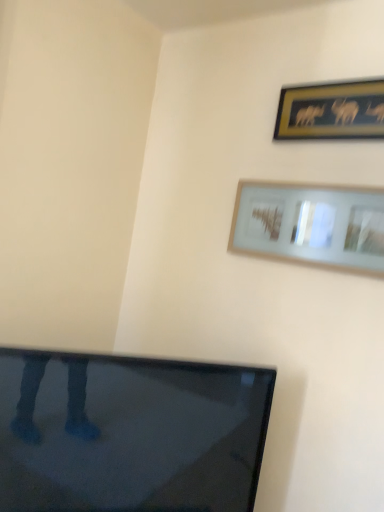
Question: From a real-world perspective, is matte glass picture frame at upper right, which appears as the 1th picture frame when ordered from the bottom, positioned above or below gold-framed picture at upper right, which appears as the first picture frame when viewed from the top?

Choices:
 (A) below
 (B) above

Answer: (A)

Question: Considering their positions, is matte glass picture frame at upper right, which appears as the 1th picture frame when ordered from the bottom, located in front of or behind gold-framed picture at upper right, which appears as the first picture frame when viewed from the top?

Choices:
 (A) behind
 (B) front

Answer: (B)

Question: Is point (360, 217) closer or farther from the camera than point (367, 99)?

Choices:
 (A) farther
 (B) closer

Answer: (B)

Question: Would you say gold-framed picture at upper right, which appears as the first picture frame when viewed from the top, is to the left or to the right of matte glass picture frame at upper right, which is the second picture frame in top-to-bottom order, in the picture?

Choices:
 (A) left
 (B) right

Answer: (B)

Question: From the image's perspective, is gold-framed picture at upper right, marked as the second picture frame in a bottom-to-top arrangement, located above or below matte glass picture frame at upper right, which appears as the 1th picture frame when ordered from the bottom?

Choices:
 (A) above
 (B) below

Answer: (A)

Question: Considering the positions of point (279, 132) and point (306, 219), is point (279, 132) closer or farther from the camera than point (306, 219)?

Choices:
 (A) closer
 (B) farther

Answer: (B)

Question: In terms of height, does gold-framed picture at upper right, which appears as the first picture frame when viewed from the top, look taller or shorter compared to matte glass picture frame at upper right, which is the second picture frame in top-to-bottom order?

Choices:
 (A) tall
 (B) short

Answer: (B)